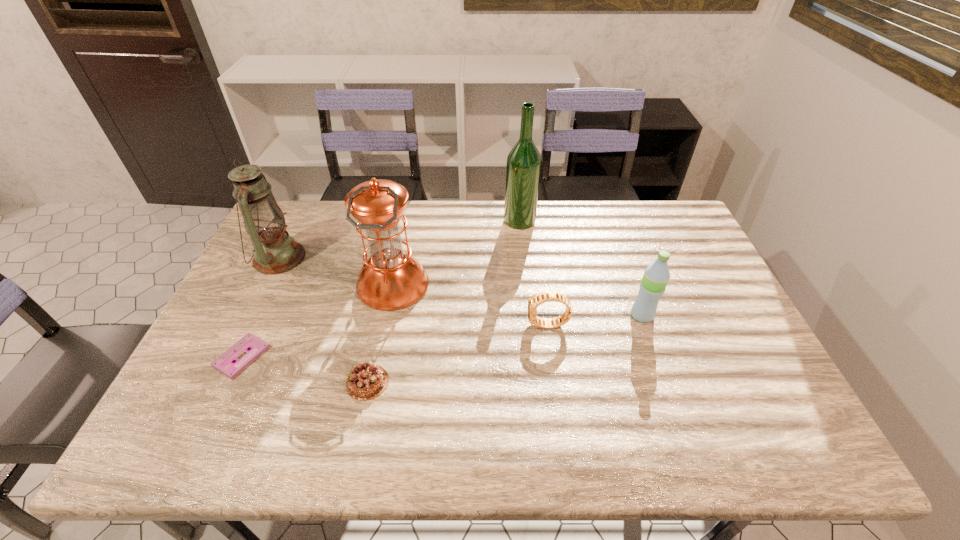
Locate an element on the screen. videotape located in the left edge section of the desktop is located at coordinates (253, 346).

Find the location of a particular element. object positioned at the far left corner is located at coordinates (274, 252).

Locate an element on the screen. vacant space at the far edge of the desktop is located at coordinates (572, 235).

I want to click on blank area at the left edge, so click(235, 403).

This screenshot has height=540, width=960. In the image, there is a desktop. Identify the location of vacant space at the right edge. (732, 322).

The width and height of the screenshot is (960, 540). In order to click on free spot at the far right corner of the desktop in this screenshot , I will do `click(657, 208)`.

Identify the location of vacant area that lies between the watch and the shortest object. This screenshot has height=540, width=960. (395, 341).

What are the coordinates of `vacant point located between the fourth tallest object and the left oil lamp` in the screenshot? It's located at (461, 286).

Where is `free space between the videotape and the third shortest object`? The image size is (960, 540). free space between the videotape and the third shortest object is located at coordinates (395, 341).

Locate an element on the screen. The width and height of the screenshot is (960, 540). free spot between the fourth shortest object and the right oil lamp is located at coordinates (517, 300).